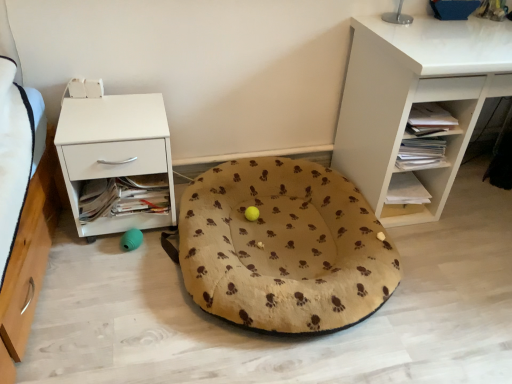
Identify the location of free space between white matte desk at upper right, arranged as the 1th shelf when viewed from the top, and beige fabric dog bed at center. This screenshot has width=512, height=384. (452, 264).